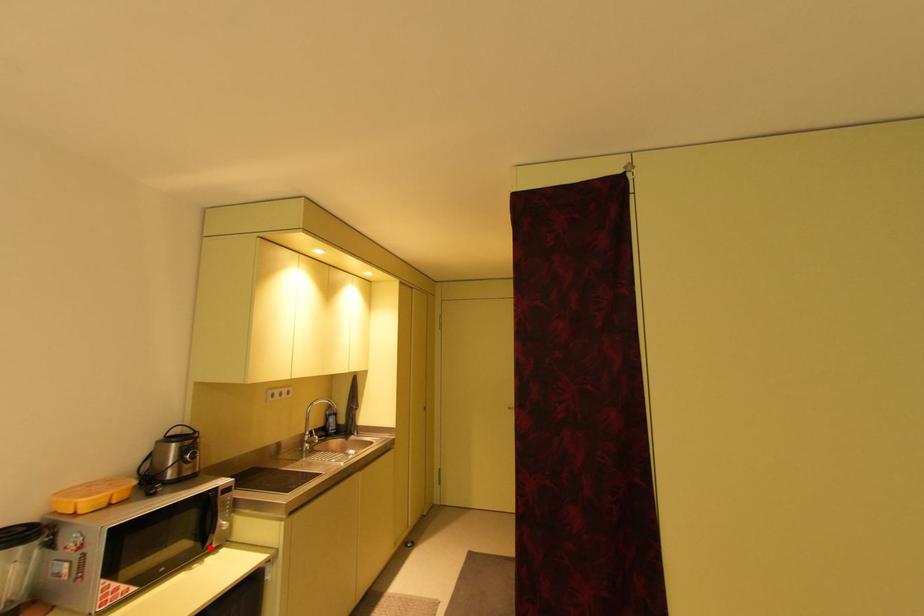
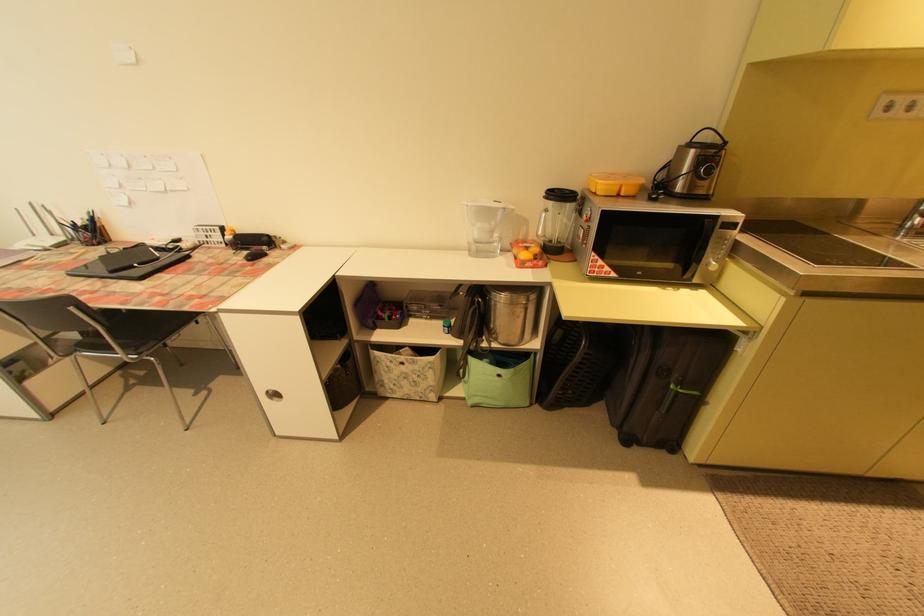
The point at the highlighted location is marked in the first image. Where is the corresponding point in the second image?

(688, 277)